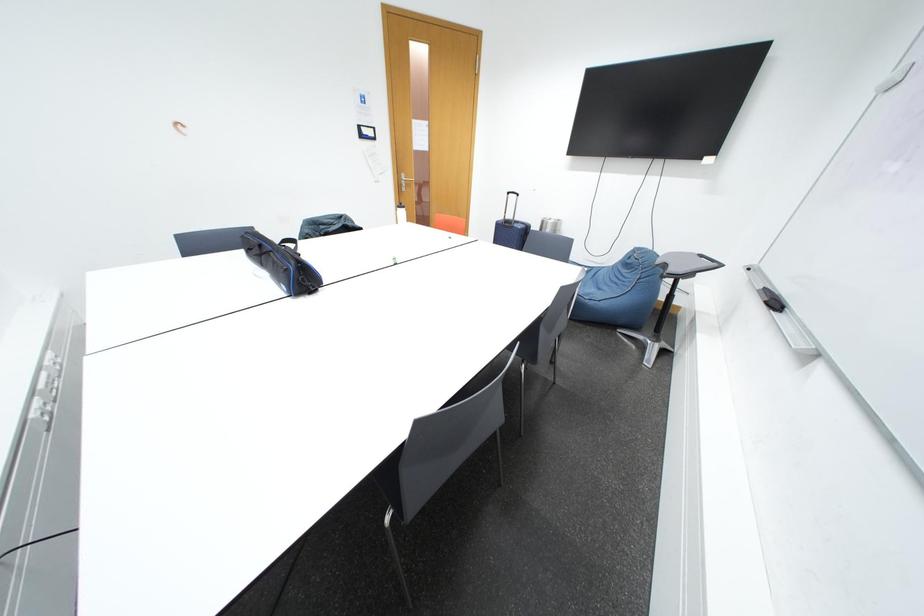
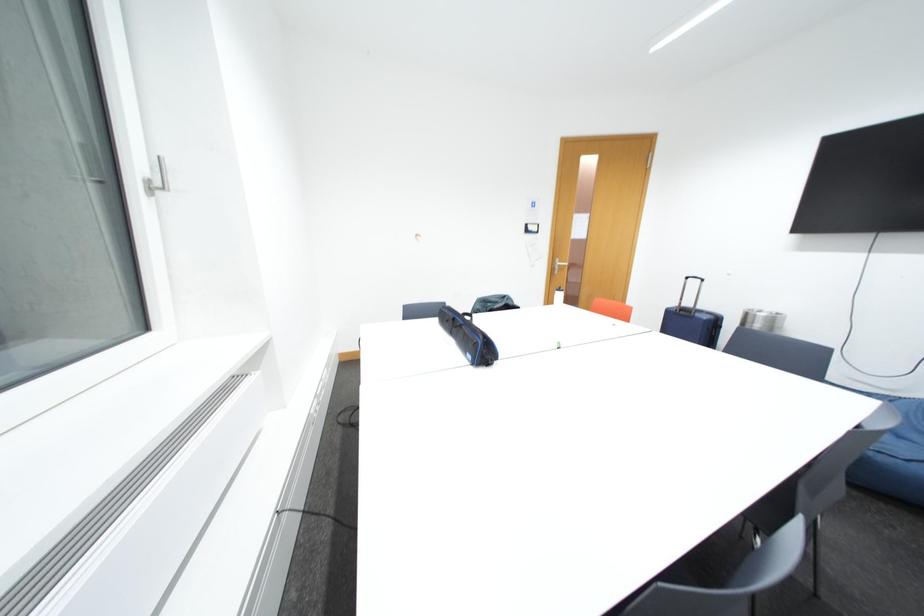
Question: The images are taken continuously from a first-person perspective. In which direction is your viewpoint rotating?

Choices:
 (A) Left
 (B) Right
 (C) Up
 (D) Down

Answer: (A)